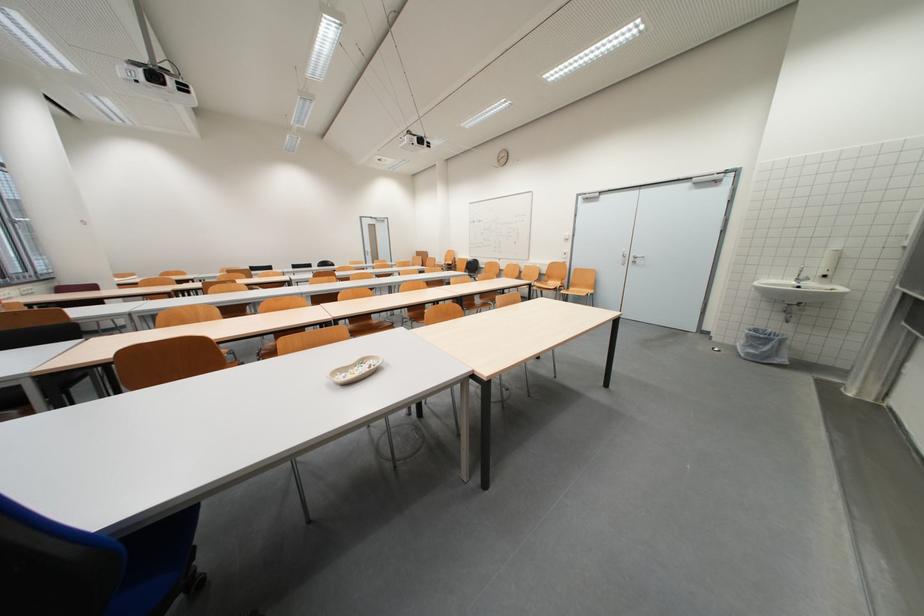
Image resolution: width=924 pixels, height=616 pixels. Describe the element at coordinates (800, 275) in the screenshot. I see `the sink faucet handle` at that location.